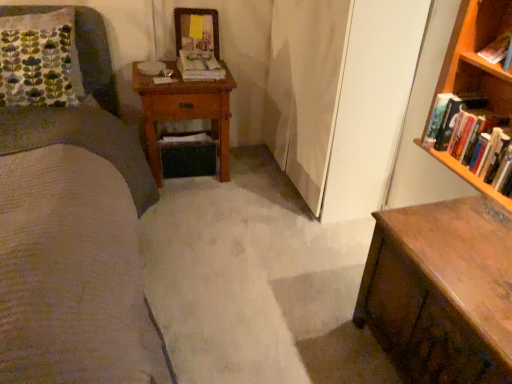
This screenshot has height=384, width=512. I want to click on free spot above wooden nightstand at center (from a real-world perspective), so click(x=172, y=74).